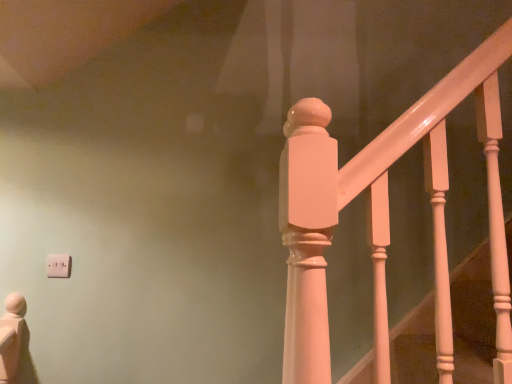
Locate an element on the screen. white plastic light switch at lower left is located at coordinates (58, 266).

Describe the element at coordinates (58, 266) in the screenshot. I see `white plastic light switch at lower left` at that location.

The width and height of the screenshot is (512, 384). Find the location of `white plastic light switch at lower left`. white plastic light switch at lower left is located at coordinates point(58,266).